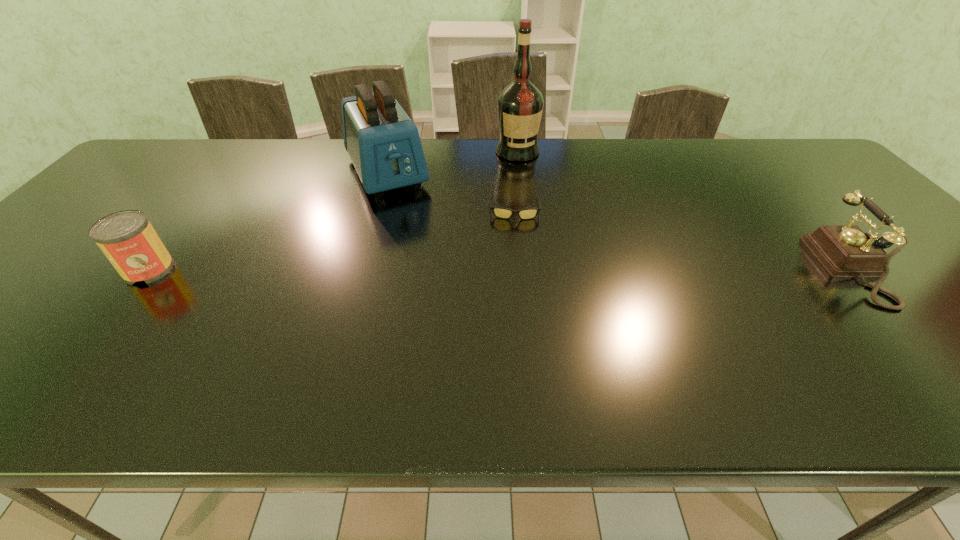
In order to click on empty space that is in between the sunglasses and the tallest object in this screenshot , I will do `click(516, 178)`.

At what (x,y) coordinates should I click in order to perform the action: click on free space between the second tallest object and the leftmost object. Please return your answer as a coordinate pair (x, y). Looking at the image, I should click on (268, 220).

The image size is (960, 540). What are the coordinates of `vacant area that lies between the sunglasses and the liquor` in the screenshot? It's located at (516, 178).

Find the location of `vacant space that is in between the fourth object from right to left and the liquor`. vacant space that is in between the fourth object from right to left and the liquor is located at coordinates (452, 161).

Find the location of a particular element. The width and height of the screenshot is (960, 540). blank region between the telephone and the leftmost object is located at coordinates (504, 269).

Where is `object that can be found as the third closest to the shortest object`? Image resolution: width=960 pixels, height=540 pixels. object that can be found as the third closest to the shortest object is located at coordinates (844, 251).

Where is `object that stands as the second closest to the liquor`? The height and width of the screenshot is (540, 960). object that stands as the second closest to the liquor is located at coordinates (384, 145).

The width and height of the screenshot is (960, 540). I want to click on free region that satisfies the following two spatial constraints: 1. on the back side of the telephone; 2. on the dial of the can, so click(149, 269).

Identify the location of vacant position in the image that satisfies the following two spatial constraints: 1. on the back side of the leftmost object; 2. on the right side of the liquor. The height and width of the screenshot is (540, 960). coord(242,152).